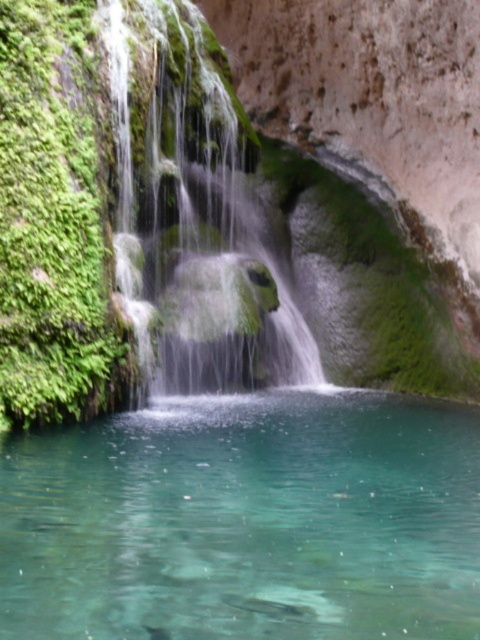
You are a photographer planning to capture the clear glass water at center and the green mossy waterfall at center in a single shot. Which object should you focus on first if you want to ensure both are in sharp focus?

The clear glass water at center is not as tall as the green mossy waterfall at center, so you should focus on the green mossy waterfall at center first to ensure both are in sharp focus.

You are a photographer planning to capture the reflection of the clear glass water at center and the green mossy waterfall at center. Since reflections often appear mirrored, which object would you expect to see on the left side of the reflection?

The clear glass water at center is positioned on the right side of green mossy waterfall at center. In the reflection, this positioning would mirror, so the green mossy waterfall at center would appear on the right side, and the clear glass water at center would be on the left side. Therefore, the clear glass water at center would be on the left side of the reflection.

You are planning to cross the pool of clear glass water at center to reach the other side. The green mossy waterfall at center is in the way. Can you walk around the waterfall to get to the other side?

The clear glass water at center is wider than the green mossy waterfall at center, so yes, you can walk around the green mossy waterfall at center to reach the other side.